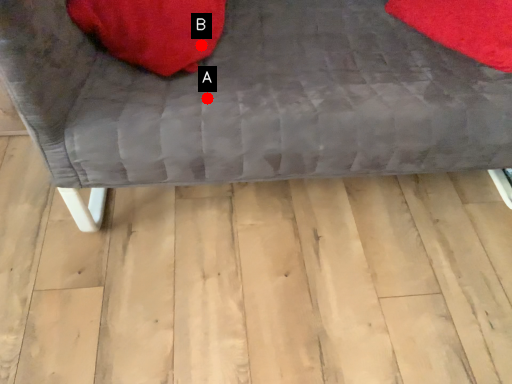
Question: Two points are circled on the image, labeled by A and B beside each circle. Which point is farther to the camera?

Choices:
 (A) A is further
 (B) B is further

Answer: (B)